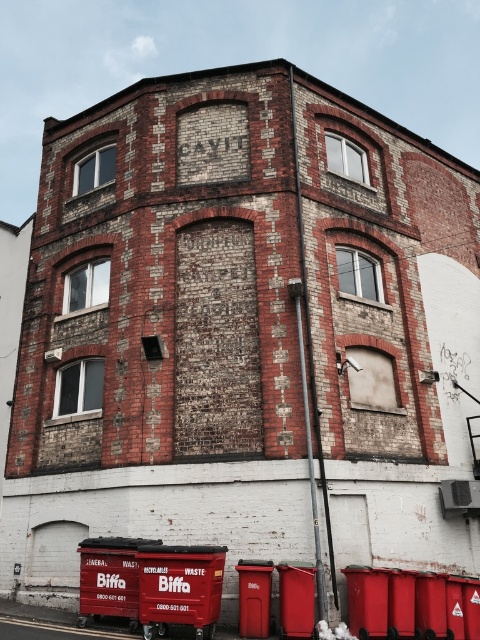
Question: Which object is positioned farthest from the metallic red bin at lower right?

Choices:
 (A) red plastic bin at lower center
 (B) matte red bin at lower center

Answer: (B)

Question: Is metallic red bin at lower right above red plastic bin at lower center?

Choices:
 (A) no
 (B) yes

Answer: (B)

Question: Which point is farther from the camera taking this photo?

Choices:
 (A) (314, 577)
 (B) (153, 604)
 (C) (263, 632)

Answer: (A)

Question: Estimate the real-world distances between objects in this image. Which object is farther from the metallic red bin at lower right?

Choices:
 (A) red plastic bin at lower center
 (B) matte red bin at lower center

Answer: (B)

Question: Is matte red bin at lower center positioned at the back of metallic red bin at lower right?

Choices:
 (A) yes
 (B) no

Answer: (B)

Question: Is matte red bin at lower center to the left of metallic red bin at lower right from the viewer's perspective?

Choices:
 (A) no
 (B) yes

Answer: (B)